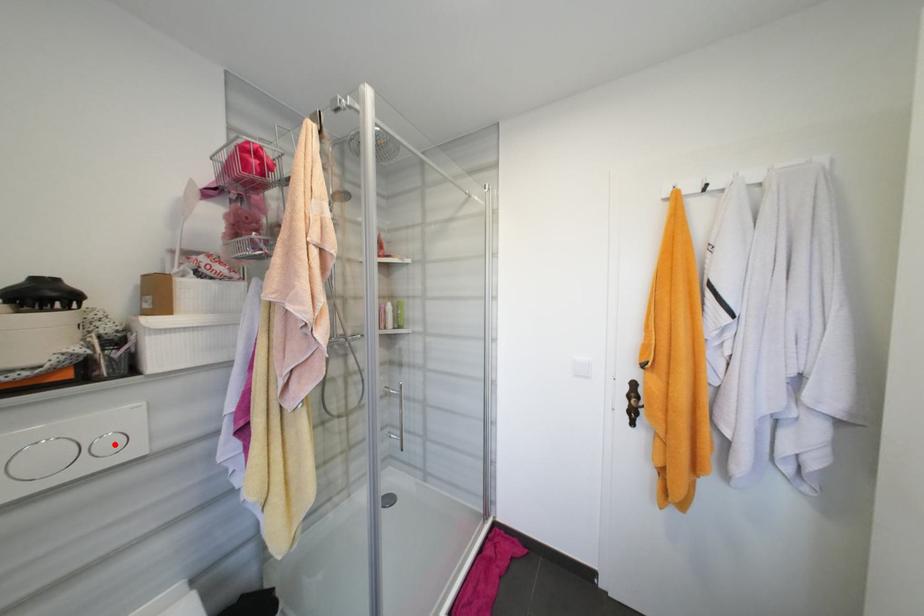
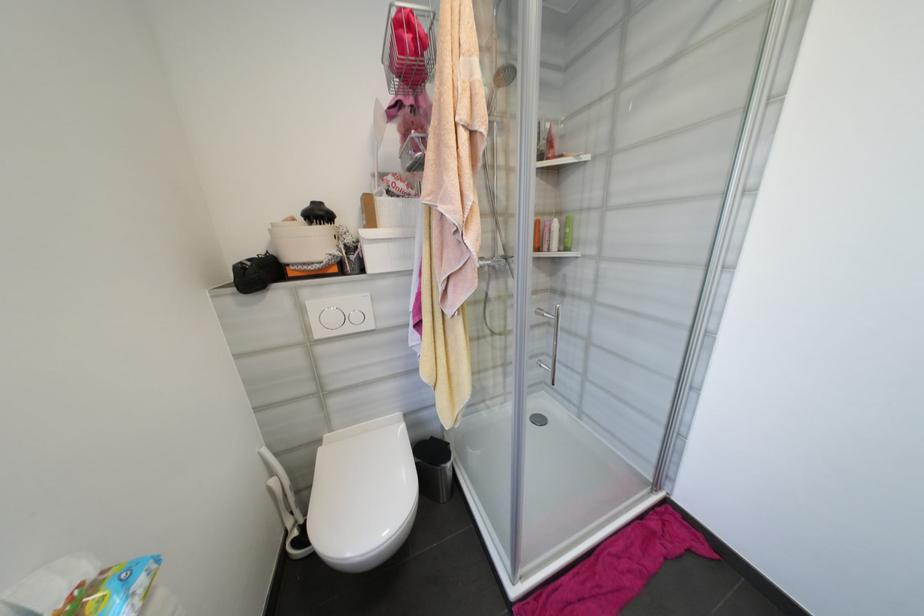
Where in the second image is the point corresponding to the highlighted location from the first image?

(361, 318)